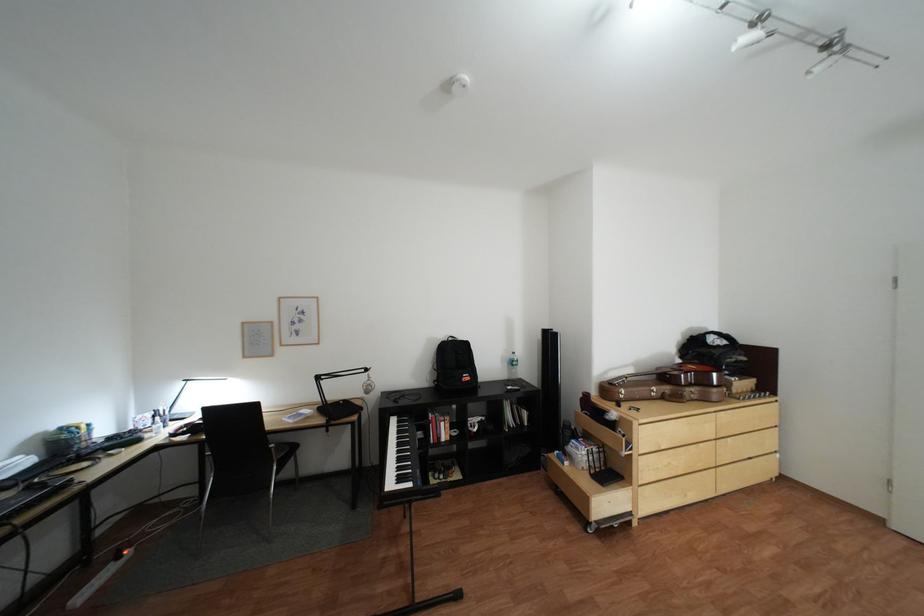
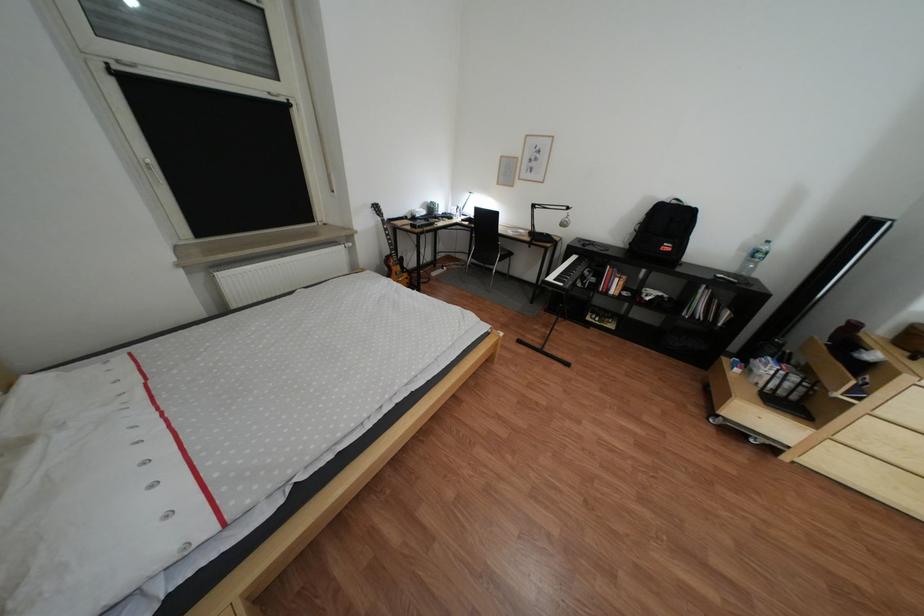
The images are taken continuously from a first-person perspective. In which direction is your viewpoint rotating?

The camera rotated toward left-down.